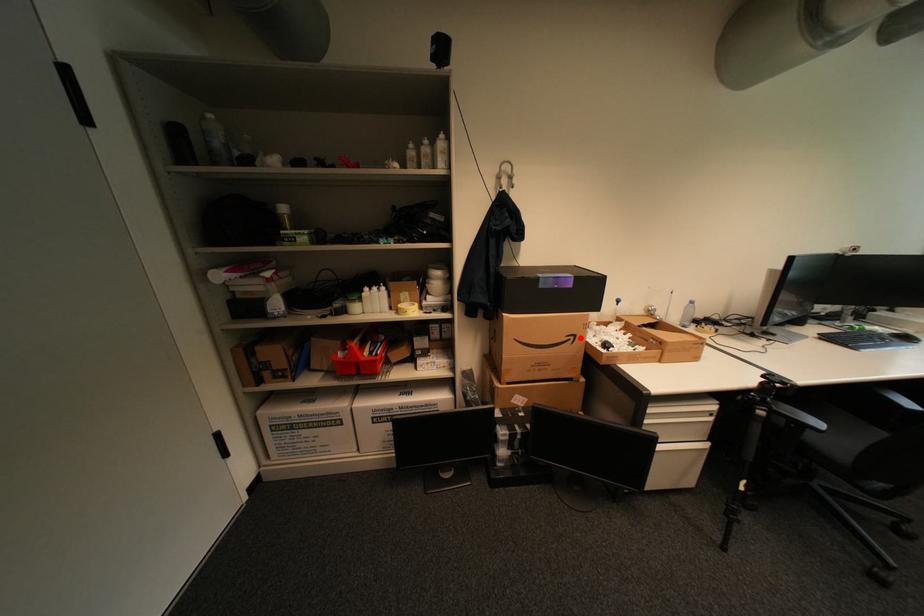
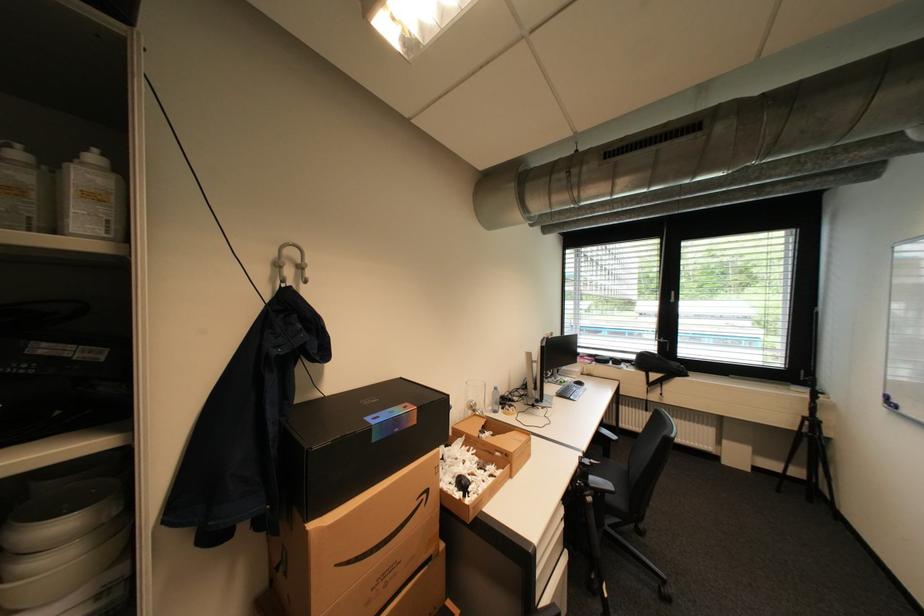
In the second image, find the point that corresponds to the highlighted location in the first image.

(433, 496)